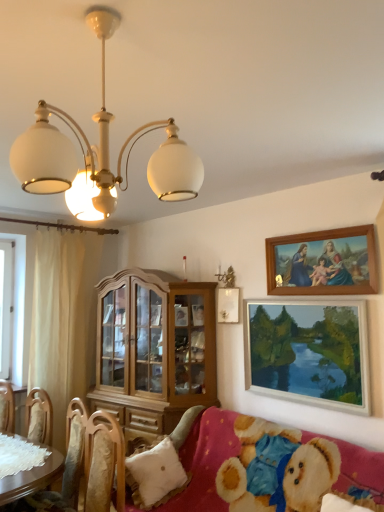
Question: From a real-world perspective, is wooden picture frame at upper right, marked as the 1th picture frame in a top-to-bottom arrangement, on light wood cabinet at center?

Choices:
 (A) yes
 (B) no

Answer: (A)

Question: From the image's perspective, is wooden picture frame at upper right, the 2th picture frame ordered from the bottom, on top of light wood cabinet at center?

Choices:
 (A) no
 (B) yes

Answer: (B)

Question: Is wooden picture frame at upper right, marked as the 1th picture frame in a top-to-bottom arrangement, shorter than light wood cabinet at center?

Choices:
 (A) yes
 (B) no

Answer: (A)

Question: Is light wood cabinet at center completely or partially inside wooden picture frame at upper right, marked as the 1th picture frame in a top-to-bottom arrangement?

Choices:
 (A) yes
 (B) no

Answer: (B)

Question: Is wooden picture frame at upper right, the 2th picture frame ordered from the bottom, positioned behind light wood cabinet at center?

Choices:
 (A) no
 (B) yes

Answer: (A)

Question: Is wooden picture frame at upper right, the 2th picture frame ordered from the bottom, wider than light wood cabinet at center?

Choices:
 (A) no
 (B) yes

Answer: (A)

Question: Does fluffy pink fabric couch at lower right have a greater height compared to wooden picture frame at upper right, marked as the 1th picture frame in a top-to-bottom arrangement?

Choices:
 (A) no
 (B) yes

Answer: (B)

Question: Would you say fluffy pink fabric couch at lower right is a long distance from wooden picture frame at upper right, the 2th picture frame ordered from the bottom?

Choices:
 (A) yes
 (B) no

Answer: (A)

Question: Is fluffy pink fabric couch at lower right looking in the opposite direction of wooden picture frame at upper right, marked as the 1th picture frame in a top-to-bottom arrangement?

Choices:
 (A) yes
 (B) no

Answer: (B)

Question: Considering the relative sizes of fluffy pink fabric couch at lower right and wooden picture frame at upper right, the 2th picture frame ordered from the bottom, in the image provided, is fluffy pink fabric couch at lower right bigger than wooden picture frame at upper right, the 2th picture frame ordered from the bottom,?

Choices:
 (A) no
 (B) yes

Answer: (B)

Question: From a real-world perspective, is fluffy pink fabric couch at lower right physically above wooden picture frame at upper right, the 2th picture frame ordered from the bottom?

Choices:
 (A) no
 (B) yes

Answer: (A)

Question: Is fluffy pink fabric couch at lower right placed right next to wooden picture frame at upper right, marked as the 1th picture frame in a top-to-bottom arrangement?

Choices:
 (A) yes
 (B) no

Answer: (B)

Question: From the image's perspective, is wooden chair at lower left on top of wooden picture frame at upper right, marked as the 1th picture frame in a top-to-bottom arrangement?

Choices:
 (A) no
 (B) yes

Answer: (A)